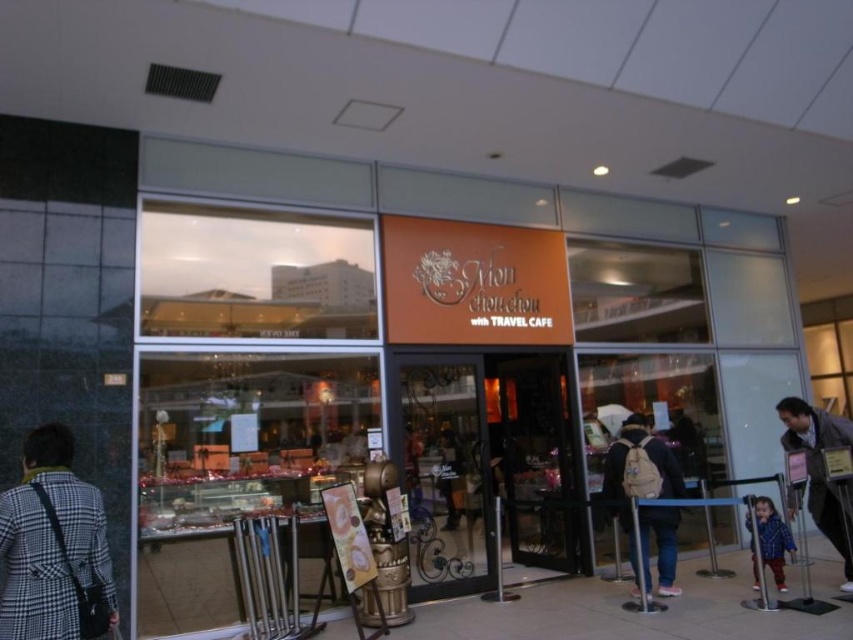
From the picture: Between beige fabric backpack at center and dark gray fabric jacket at center, which one is positioned lower?

Positioned lower is beige fabric backpack at center.

Who is more forward, (621, 474) or (442, 464)?

Point (621, 474) is in front.

The width and height of the screenshot is (853, 640). What do you see at coordinates (637, 474) in the screenshot?
I see `beige fabric backpack at center` at bounding box center [637, 474].

Image resolution: width=853 pixels, height=640 pixels. Find the location of `beige fabric backpack at center`. beige fabric backpack at center is located at coordinates (637, 474).

Between point (663, 545) and point (827, 518), which one is positioned in front?

Positioned in front is point (827, 518).

Between point (619, 492) and point (843, 547), which one is positioned behind?

The point (619, 492) is more distant.

Between point (643, 461) and point (827, 500), which one is positioned behind?

Point (643, 461)

I want to click on beige fabric backpack at center, so click(x=637, y=474).

From the picture: Is blue plaid shirt at lower right to the right of dark gray fabric jacket at center from the viewer's perspective?

Correct, you'll find blue plaid shirt at lower right to the right of dark gray fabric jacket at center.

Who is positioned more to the right, blue plaid shirt at lower right or dark gray fabric jacket at center?

From the viewer's perspective, blue plaid shirt at lower right appears more on the right side.

Measure the distance between blue plaid shirt at lower right and camera.

5.00 meters

At what (x,y) coordinates should I click in order to perform the action: click on blue plaid shirt at lower right. Please return your answer as a coordinate pair (x, y). The image size is (853, 640). Looking at the image, I should click on (772, 538).